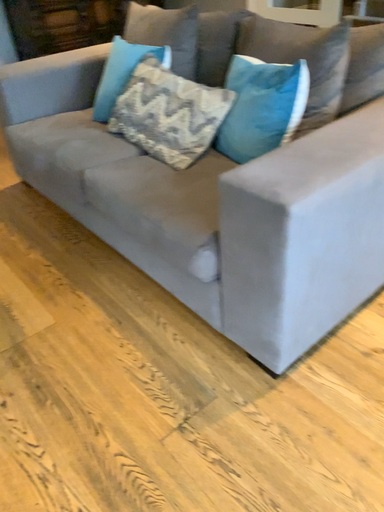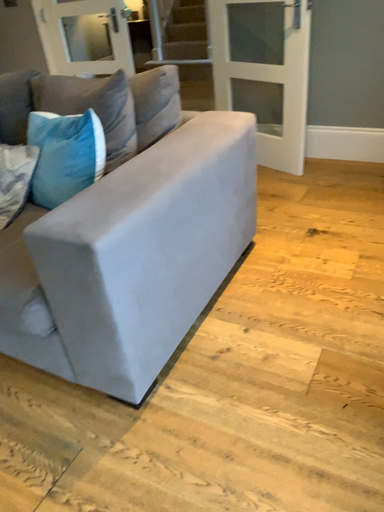
Question: Which way did the camera rotate in the video?

Choices:
 (A) rotated downward
 (B) rotated upward

Answer: (B)